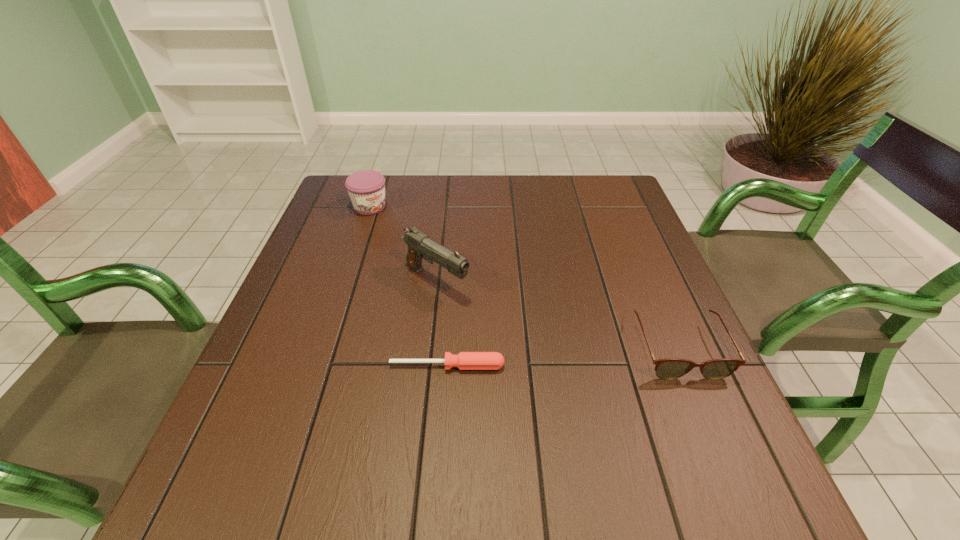
Where is `vacant point located on the front label of the farthest object`? This screenshot has width=960, height=540. vacant point located on the front label of the farthest object is located at coordinates (439, 262).

At what (x,y) coordinates should I click in order to perform the action: click on free space located in the direction the gun is aimed. Please return your answer as a coordinate pair (x, y). Looking at the image, I should click on (542, 349).

This screenshot has width=960, height=540. I want to click on free space located in the direction the gun is aimed, so click(x=477, y=306).

Locate an element on the screen. The image size is (960, 540). vacant area situated 0.170m in the direction the gun is aimed is located at coordinates (519, 334).

Where is `object present at the far edge`? Image resolution: width=960 pixels, height=540 pixels. object present at the far edge is located at coordinates (366, 188).

Where is `object present at the left edge`? object present at the left edge is located at coordinates (366, 188).

This screenshot has width=960, height=540. What are the coordinates of `object at the right edge` in the screenshot? It's located at (670, 368).

Find the location of a particular element. The image size is (960, 540). object present at the far left corner is located at coordinates (366, 188).

This screenshot has height=540, width=960. Identify the location of free point at the far edge. (407, 201).

Find the location of a particular element. Image resolution: width=960 pixels, height=540 pixels. vacant space at the near edge is located at coordinates (572, 426).